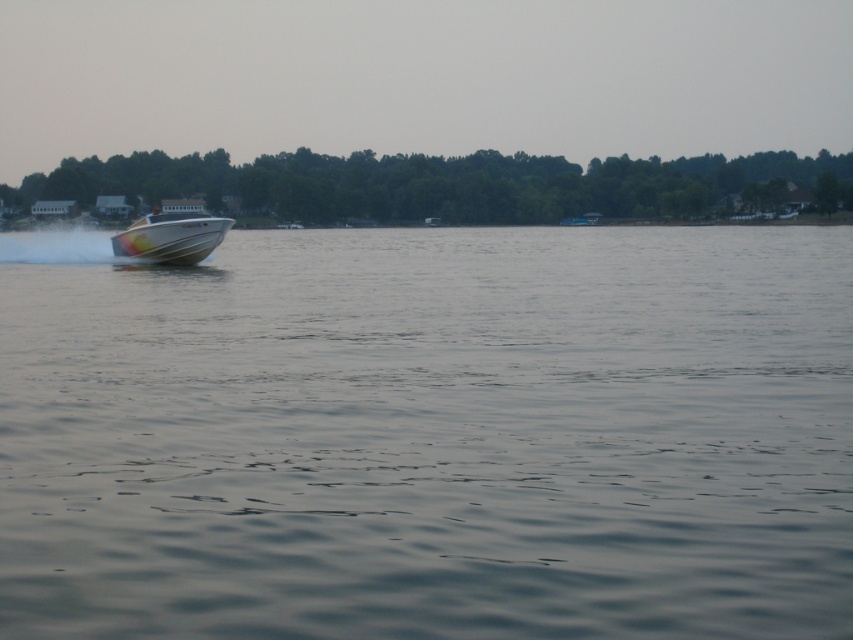
Question: Can you confirm if clear water at center is smaller than white glossy boat at left?

Choices:
 (A) no
 (B) yes

Answer: (B)

Question: Does clear water at center appear over white glossy boat at left?

Choices:
 (A) no
 (B) yes

Answer: (A)

Question: Does clear water at center come behind white glossy boat at left?

Choices:
 (A) yes
 (B) no

Answer: (B)

Question: Among these objects, which one is nearest to the camera?

Choices:
 (A) white glossy boat at left
 (B) clear water at center

Answer: (B)